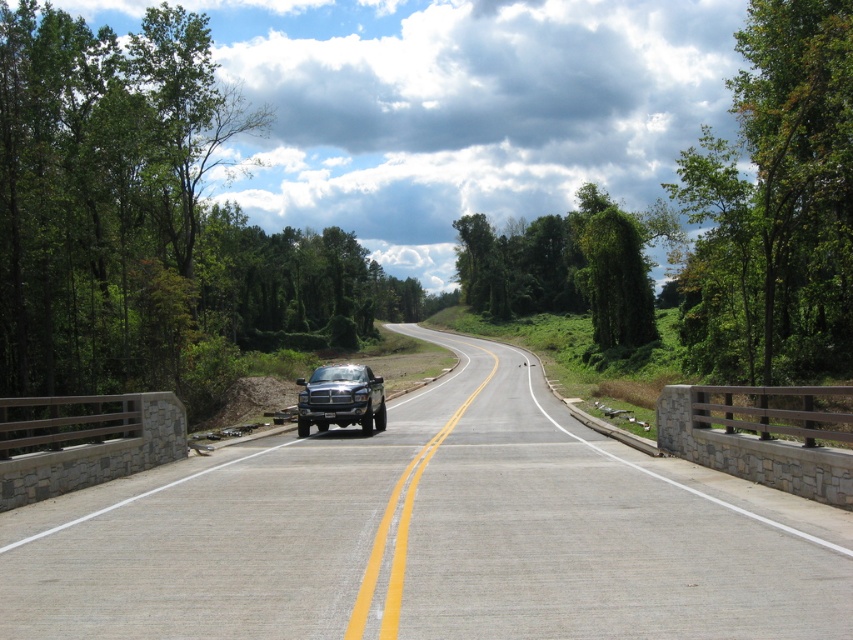
You are a delivery driver planning to overtake the matte black truck at center on a gray asphalt highway at center. Considering the road width, is there enough space for a safe overtaking maneuver?

The gray asphalt highway at center is wider than the matte black truck at center, so there is enough space for a safe overtaking maneuver.

You are a pedestrian standing on the side of the road. You see the gray asphalt highway at center and the matte black truck at center. How far apart are they?

The gray asphalt highway at center and the matte black truck at center are 5.54 meters apart.

You are a pedestrian standing on the side of the road and want to cross the gray asphalt highway at center. The matte black truck at center is approaching from your left. Which direction should you look first before crossing?

You should look to the right side of the matte black truck at center first because the gray asphalt highway at center is positioned on its right side, meaning the truck is on your left and the highway extends to the right. Check the right direction first to ensure no oncoming traffic is coming from that direction.